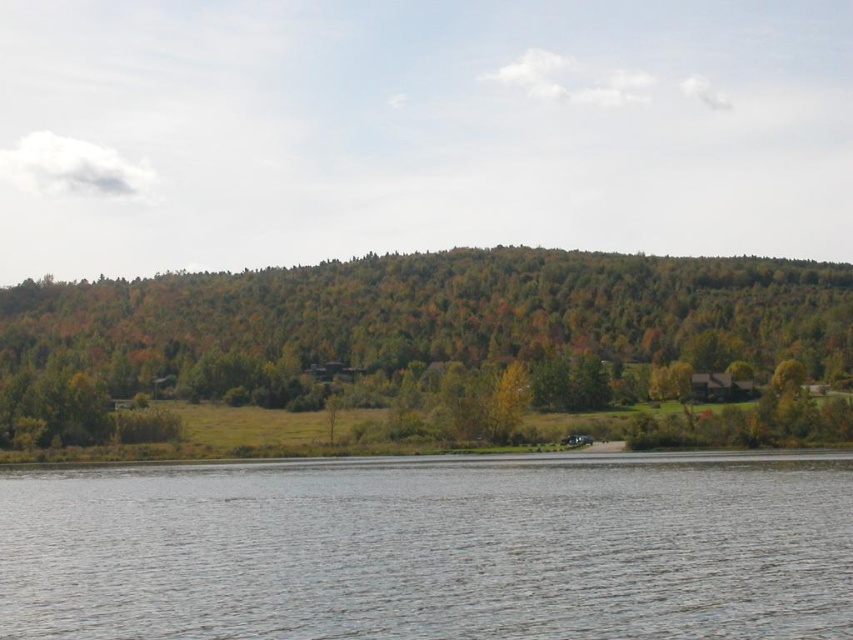
You are standing at the edge of the water in the image. Which object, the clear water at lower center or the green leafy trees at center, would you see first as you look straight ahead?

The clear water at lower center would be seen first because it is closer to your position at the edge of the water compared to the green leafy trees at center, which are further away.